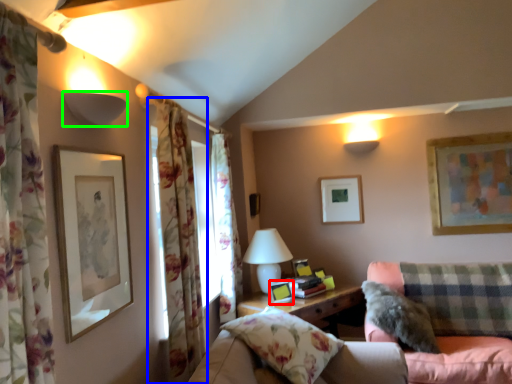
Question: Which is nearer to the picture frame (highlighted by a red box)? curtain (highlighted by a blue box) or lamp (highlighted by a green box).

Choices:
 (A) curtain
 (B) lamp

Answer: (A)